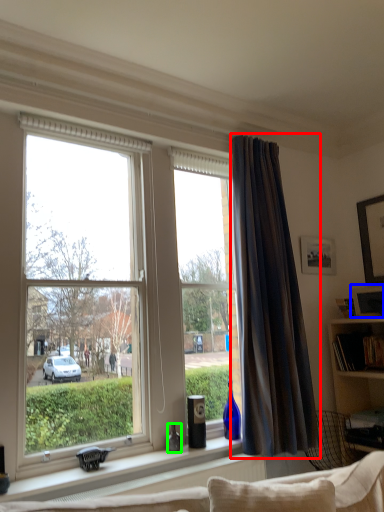
Question: Which object is positioned closest to curtain (highlighted by a red box)? Select from picture frame (highlighted by a blue box) and bottle (highlighted by a green box).

Choices:
 (A) picture frame
 (B) bottle

Answer: (A)